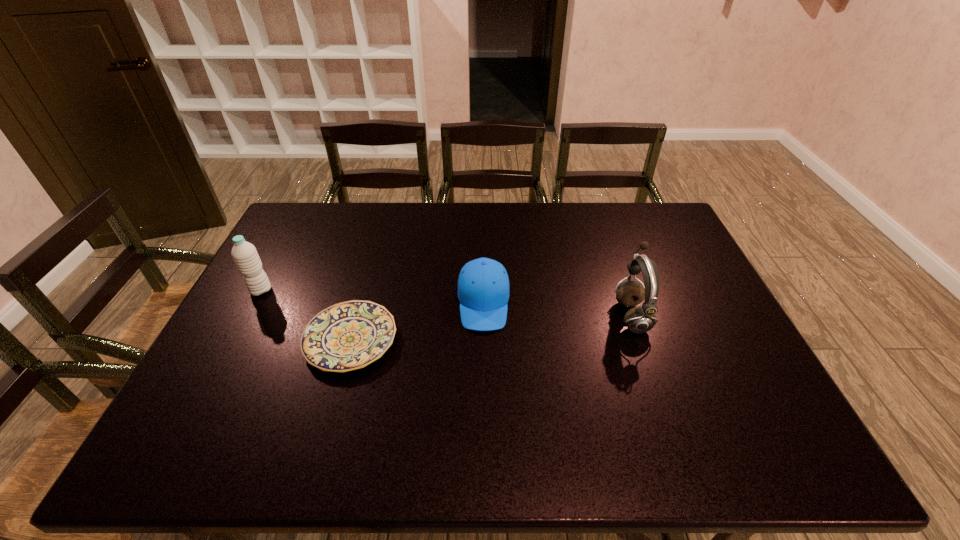
The image size is (960, 540). Identify the location of earphone. (641, 319).

Where is `the leftmost object`? Image resolution: width=960 pixels, height=540 pixels. the leftmost object is located at coordinates (246, 258).

Locate an element on the screen. This screenshot has width=960, height=540. the second shortest object is located at coordinates (483, 286).

This screenshot has height=540, width=960. I want to click on cap, so click(x=483, y=286).

At what (x,y) coordinates should I click in order to perform the action: click on the shortest object. Please return your answer as a coordinate pair (x, y). The image size is (960, 540). Looking at the image, I should click on (346, 336).

Find the location of a particular element. Image resolution: width=960 pixels, height=540 pixels. plate is located at coordinates (346, 336).

In order to click on free space located on the ear pads of the rightmost object in this screenshot , I will do `click(490, 315)`.

Find the location of `vacant point located on the ear pads of the rightmost object`. vacant point located on the ear pads of the rightmost object is located at coordinates pos(539,315).

The width and height of the screenshot is (960, 540). In order to click on vacant region located 0.250m on the ear pads of the rightmost object in this screenshot , I will do coord(528,315).

At what (x,y) coordinates should I click in order to perform the action: click on free space located on the front of the water bottle. Please return your answer as a coordinate pair (x, y). Looking at the image, I should click on (241, 328).